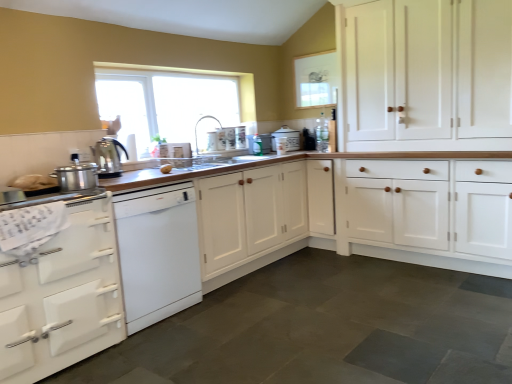
This screenshot has height=384, width=512. What do you see at coordinates (426, 74) in the screenshot? I see `white wood cabinet at right, which is the 3th cabinetry in left-to-right order` at bounding box center [426, 74].

Find the location of `slate gray stone countertop at lower left`. slate gray stone countertop at lower left is located at coordinates (351, 207).

Image resolution: width=512 pixels, height=384 pixels. What do you see at coordinates (108, 157) in the screenshot?
I see `satin silver kettle at center, the first kitchen appliance in the back-to-front sequence` at bounding box center [108, 157].

The height and width of the screenshot is (384, 512). I want to click on white glossy dishwasher at left, so click(158, 253).

I want to click on polished stainless steel pot at left, which is counted as the second kitchen appliance, starting from the back, so click(76, 175).

This screenshot has height=384, width=512. In order to click on metallic silver trash can at center, positioned as the second appliance in top-to-bottom order in this screenshot , I will do `click(259, 144)`.

Measure the distance between point (257,134) and camera.

A distance of 4.03 meters exists between point (257,134) and camera.

This screenshot has height=384, width=512. What do you see at coordinates (58, 198) in the screenshot? I see `white glossy oven at left, the 1th appliance viewed from the left` at bounding box center [58, 198].

At what (x,y) coordinates should I click in order to perform the action: click on white wood cabinet at right, which is the 3th cabinetry in left-to-right order. Please return your answer as a coordinate pair (x, y). Image resolution: width=512 pixels, height=384 pixels. Looking at the image, I should click on (426, 74).

From a real-world perspective, is white wood cabinet at right, which is the 3th cabinetry in left-to-right order, below white glossy dishwasher at left?

No, from a real-world perspective, white wood cabinet at right, which is the 3th cabinetry in left-to-right order, is not beneath white glossy dishwasher at left.

Could you tell me if white wood cabinet at right, which is the 3th cabinetry in left-to-right order, is turned towards white glossy dishwasher at left?

No, white wood cabinet at right, which is the 3th cabinetry in left-to-right order, is not oriented towards white glossy dishwasher at left.

Can you tell me how much white wood cabinet at right, marked as the 1th cabinetry in a right-to-left arrangement, and white glossy dishwasher at left differ in facing direction?

89.4 degrees.

Is white wood cabinet at right, marked as the 1th cabinetry in a right-to-left arrangement, positioned behind white glossy dishwasher at left?

That is True.

From the picture: Is clear glass window at upper center closer to camera compared to metallic silver trash can at center, positioned as the second appliance in top-to-bottom order?

Yes.

In terms of size, does clear glass window at upper center appear bigger or smaller than metallic silver trash can at center, which is the 2th appliance from right to left?

clear glass window at upper center is bigger than metallic silver trash can at center, which is the 2th appliance from right to left.

Looking at their sizes, would you say clear glass window at upper center is wider or thinner than metallic silver trash can at center, positioned as the second appliance in top-to-bottom order?

Considering their sizes, clear glass window at upper center looks slimmer than metallic silver trash can at center, positioned as the second appliance in top-to-bottom order.

Is satin nickel faucet at center positioned with its back to white glossy oven at left, placed as the first appliance when sorted from bottom to top?

No, satin nickel faucet at center's orientation is not away from white glossy oven at left, placed as the first appliance when sorted from bottom to top.

Is satin nickel faucet at center to the left or to the right of white glossy oven at left, which is counted as the first appliance, starting from the front, in the image?

satin nickel faucet at center is to the right of white glossy oven at left, which is counted as the first appliance, starting from the front.

Is satin nickel faucet at center taller or shorter than white glossy oven at left, placed as the 4th appliance when sorted from top to bottom?

satin nickel faucet at center is taller than white glossy oven at left, placed as the 4th appliance when sorted from top to bottom.

Could you tell me if satin nickel faucet at center is turned towards white glossy dishwasher at left?

No, satin nickel faucet at center does not turn towards white glossy dishwasher at left.

Is the surface of satin nickel faucet at center in direct contact with white glossy dishwasher at left?

No, satin nickel faucet at center is not in contact with white glossy dishwasher at left.

Which object is further away from the camera, satin nickel faucet at center or white glossy dishwasher at left?

satin nickel faucet at center is further away from the camera.

Identify the location of home appliance that appears in front of the satin nickel faucet at center. (158, 253).

Which of these two, slate gray stone countertop at lower left or polished stainless steel pot at left, acting as the 1th kitchen appliance starting from the front, is thinner?

polished stainless steel pot at left, acting as the 1th kitchen appliance starting from the front, is thinner.

Is slate gray stone countertop at lower left to the right of polished stainless steel pot at left, which is counted as the second kitchen appliance, starting from the back, from the viewer's perspective?

Yes, slate gray stone countertop at lower left is to the right of polished stainless steel pot at left, which is counted as the second kitchen appliance, starting from the back.

Is polished stainless steel pot at left, acting as the 1th kitchen appliance starting from the front, inside slate gray stone countertop at lower left?

No.

Between slate gray stone countertop at lower left and polished stainless steel pot at left, acting as the 1th kitchen appliance starting from the front, which one has smaller size?

With smaller size is polished stainless steel pot at left, acting as the 1th kitchen appliance starting from the front.

In the image, is white plastic toaster at upper center, the second appliance when ordered from front to back, on the left side or the right side of metallic silver trash can at center, positioned as the 2th appliance in back-to-front order?

white plastic toaster at upper center, the second appliance when ordered from front to back, is positioned on metallic silver trash can at center, positioned as the 2th appliance in back-to-front order,'s left side.

Considering the relative sizes of white plastic toaster at upper center, which is the second appliance from left to right, and metallic silver trash can at center, positioned as the second appliance in top-to-bottom order, in the image provided, is white plastic toaster at upper center, which is the second appliance from left to right, smaller than metallic silver trash can at center, positioned as the second appliance in top-to-bottom order,?

Indeed, white plastic toaster at upper center, which is the second appliance from left to right, has a smaller size compared to metallic silver trash can at center, positioned as the second appliance in top-to-bottom order.

Measure the distance from white plastic toaster at upper center, the second appliance when ordered from front to back, to metallic silver trash can at center, positioned as the second appliance in top-to-bottom order.

white plastic toaster at upper center, the second appliance when ordered from front to back, is 68.02 centimeters away from metallic silver trash can at center, positioned as the second appliance in top-to-bottom order.

Does white plastic toaster at upper center, arranged as the 2th appliance when ordered from the bottom, turn towards metallic silver trash can at center, positioned as the 2th appliance in back-to-front order?

No, white plastic toaster at upper center, arranged as the 2th appliance when ordered from the bottom, is not turned towards metallic silver trash can at center, positioned as the 2th appliance in back-to-front order.

Which object is further away from the camera, slate gray stone countertop at lower left or satin silver kettle at center, the first kitchen appliance in the back-to-front sequence?

satin silver kettle at center, the first kitchen appliance in the back-to-front sequence, is further from the camera.

Based on the photo, can you confirm if slate gray stone countertop at lower left is taller than satin silver kettle at center, the first kitchen appliance in the back-to-front sequence?

In fact, slate gray stone countertop at lower left may be shorter than satin silver kettle at center, the first kitchen appliance in the back-to-front sequence.

Considering the relative positions of slate gray stone countertop at lower left and satin silver kettle at center, the first kitchen appliance in the back-to-front sequence, in the image provided, is slate gray stone countertop at lower left to the left or to the right of satin silver kettle at center, the first kitchen appliance in the back-to-front sequence,?

In the image, slate gray stone countertop at lower left appears on the right side of satin silver kettle at center, the first kitchen appliance in the back-to-front sequence.

From the image's perspective, does slate gray stone countertop at lower left appear lower than satin silver kettle at center, which is the 2th kitchen appliance in front-to-back order?

Indeed, from the image's perspective, slate gray stone countertop at lower left is shown beneath satin silver kettle at center, which is the 2th kitchen appliance in front-to-back order.

In order to click on the 2nd cabinetry counting from the right side of the white glossy dishwasher at left in this screenshot , I will do `click(426, 74)`.

You are a GUI agent. You are given a task and a screenshot of the screen. Output one action in this format:
    pyautogui.click(x=<x>, y=<y>)
    Task: Click on the window above the metallic silver trash can at center, positioned as the 2th appliance in back-to-front order (from a real-world perspective)
    The height and width of the screenshot is (384, 512).
    Given the screenshot: What is the action you would take?
    pyautogui.click(x=169, y=100)

Estimate the real-world distances between objects in this image. Which object is further from polished stainless steel pot at left, which is counted as the second kitchen appliance, starting from the back, yellow matte potato at center or white ceramic bread bin at center, the fourth appliance positioned from the front?

The object further to polished stainless steel pot at left, which is counted as the second kitchen appliance, starting from the back, is white ceramic bread bin at center, the fourth appliance positioned from the front.

Based on the photo, which object lies further to the anchor point satin nickel faucet at center, polished stainless steel pot at left, acting as the 1th kitchen appliance starting from the front, or yellow matte potato at center?

Based on the image, polished stainless steel pot at left, acting as the 1th kitchen appliance starting from the front, appears to be further to satin nickel faucet at center.

Estimate the real-world distances between objects in this image. Which object is closer to clear glass window at upper center, white ceramic bread bin at center, the fourth appliance positioned from the bottom, or slate gray stone countertop at lower left?

Based on the image, white ceramic bread bin at center, the fourth appliance positioned from the bottom, appears to be nearer to clear glass window at upper center.

Looking at the image, which one is located further to white matte oven at lower left, which appears as the first cabinetry when viewed from the left, white ceramic bread bin at center, positioned as the first appliance in top-to-bottom order, or white wood cabinet at right, marked as the 1th cabinetry in a right-to-left arrangement?

white wood cabinet at right, marked as the 1th cabinetry in a right-to-left arrangement, is positioned further to the anchor white matte oven at lower left, which appears as the first cabinetry when viewed from the left.

Estimate the real-world distances between objects in this image. Which object is closer to yellow matte potato at center, clear glass window at upper center or white glossy dishwasher at left?

white glossy dishwasher at left is closer to yellow matte potato at center.

Which object lies nearer to the anchor point white matte oven at lower left, arranged as the third cabinetry when viewed from the right, white wood cabinet at right, which is the 3th cabinetry in left-to-right order, or white plastic toaster at upper center, the second appliance when ordered from front to back?

The object closer to white matte oven at lower left, arranged as the third cabinetry when viewed from the right, is white plastic toaster at upper center, the second appliance when ordered from front to back.

Which object lies nearer to the anchor point white matte oven at lower left, arranged as the third cabinetry when viewed from the right, polished stainless steel pot at left, which is counted as the second kitchen appliance, starting from the back, or clear glass window at upper center?

Among the two, polished stainless steel pot at left, which is counted as the second kitchen appliance, starting from the back, is located nearer to white matte oven at lower left, arranged as the third cabinetry when viewed from the right.

From the image, which object appears to be nearer to yellow matte potato at center, white matte cabinet at center, placed as the 2th cabinetry when sorted from left to right, or white plastic toaster at upper center, which appears as the third appliance when viewed from the top?

white plastic toaster at upper center, which appears as the third appliance when viewed from the top, lies closer to yellow matte potato at center than the other object.

Image resolution: width=512 pixels, height=384 pixels. Find the location of `food between polished stainless steel pot at left, which is counted as the second kitchen appliance, starting from the back, and white matte cabinet at center, placed as the 2th cabinetry when sorted from left to right, from front to back`. food between polished stainless steel pot at left, which is counted as the second kitchen appliance, starting from the back, and white matte cabinet at center, placed as the 2th cabinetry when sorted from left to right, from front to back is located at coordinates (166, 168).

At what (x,y) coordinates should I click in order to perform the action: click on home appliance between polished stainless steel pot at left, acting as the 1th kitchen appliance starting from the front, and clear glass window at upper center, along the z-axis. Please return your answer as a coordinate pair (x, y). The image size is (512, 384). Looking at the image, I should click on (158, 253).

You are a GUI agent. You are given a task and a screenshot of the screen. Output one action in this format:
    pyautogui.click(x=<x>, y=<y>)
    Task: Click on the window located between polished stainless steel pot at left, which is counted as the second kitchen appliance, starting from the back, and metallic silver trash can at center, which ranks as the third appliance in left-to-right order, in the depth direction
    Image resolution: width=512 pixels, height=384 pixels.
    Given the screenshot: What is the action you would take?
    pyautogui.click(x=169, y=100)

The image size is (512, 384). Find the location of `appliance located between white matte oven at lower left, arranged as the third cabinetry when viewed from the right, and satin silver kettle at center, the first kitchen appliance in the back-to-front sequence, in the depth direction`. appliance located between white matte oven at lower left, arranged as the third cabinetry when viewed from the right, and satin silver kettle at center, the first kitchen appliance in the back-to-front sequence, in the depth direction is located at coordinates (58, 198).